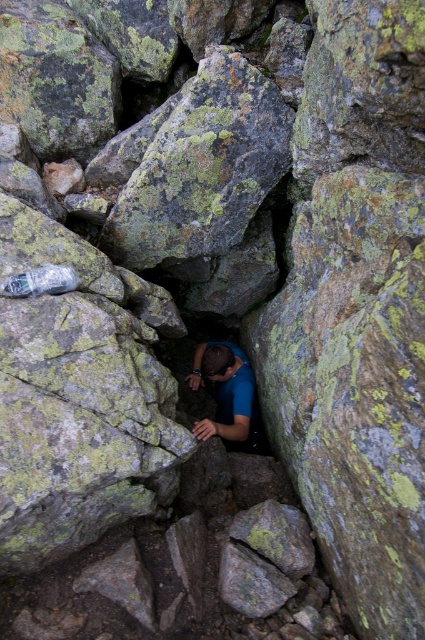
Question: Does blue fabric at center lie in front of transparent plastic bottle at lower left?

Choices:
 (A) no
 (B) yes

Answer: (A)

Question: Observing the image, what is the correct spatial positioning of blue fabric at center in reference to transparent plastic bottle at lower left?

Choices:
 (A) left
 (B) right

Answer: (B)

Question: Where is blue fabric at center located in relation to transparent plastic bottle at lower left in the image?

Choices:
 (A) left
 (B) right

Answer: (B)

Question: Among these points, which one is farthest from the camera?

Choices:
 (A) (212, 420)
 (B) (22, 284)

Answer: (A)

Question: Which point is closer to the camera taking this photo?

Choices:
 (A) click(3, 288)
 (B) click(235, 394)

Answer: (A)